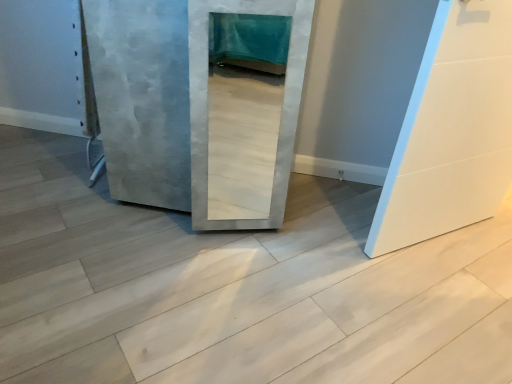
Image resolution: width=512 pixels, height=384 pixels. Identify the location of free space in front of white matte door at right, placed as the 1th door when sorted from right to left. (441, 310).